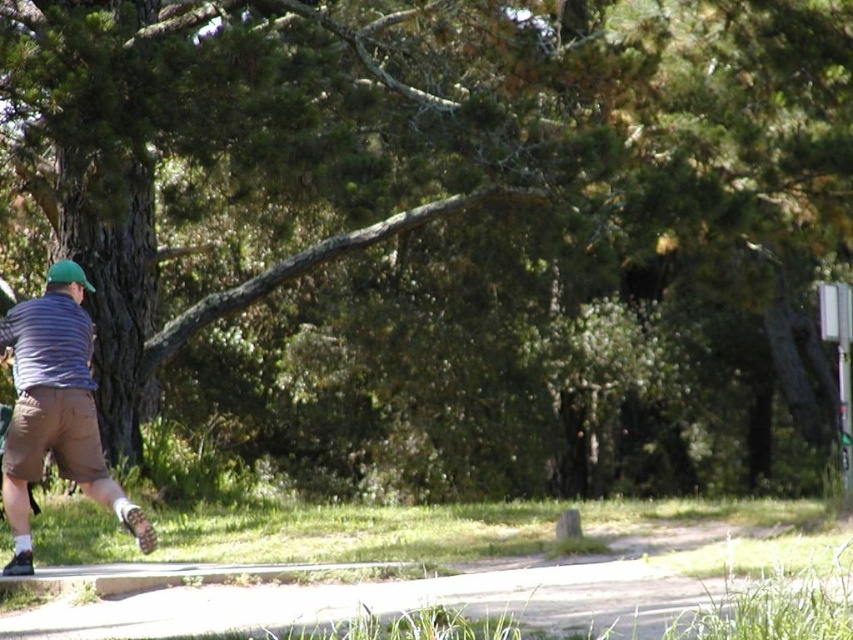
Which of these two, green grass at lower center or striped cotton shirt at left, stands taller?

striped cotton shirt at left

How much distance is there between green grass at lower center and striped cotton shirt at left?

They are 6.56 feet apart.

Where is `green grass at lower center`? The width and height of the screenshot is (853, 640). green grass at lower center is located at coordinates (419, 595).